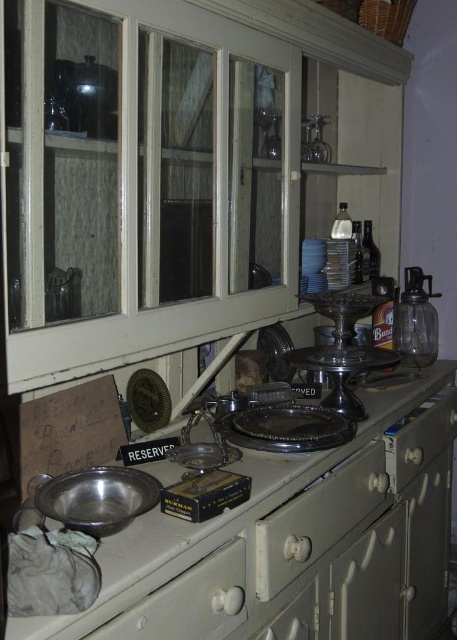
You are a delivery person who just arrived at the house. You need to place a small package on top of the white painted wood drawer at center. However, you are 1.3 meters tall. Can you reach the top of the cabinet to place the package there?

The white painted wood drawer at center and the viewer are 1.08 meters apart. Since the delivery person is 1.3 meters tall, they can comfortably reach the top of the cabinet to place the package on the white painted wood drawer at center.